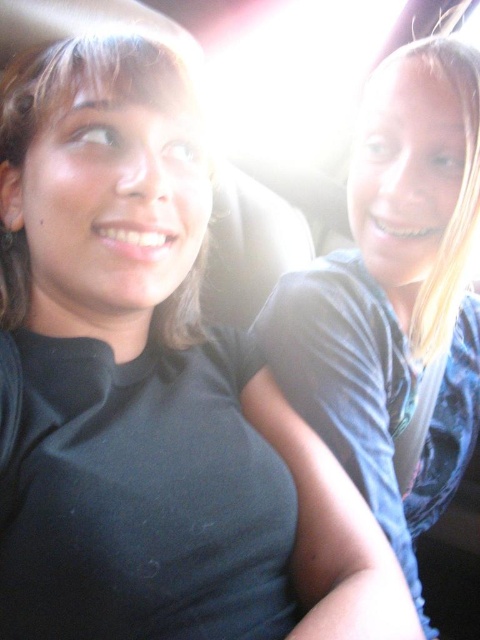
You are a photographer trying to capture a candid shot of the two people in the vehicle. You want to ensure the focus is on the point at point (312, 310). Given that your camera has a depth of field that can clearly capture objects within 30 inches from the focus point, will the two people be in focus?

The point (312, 310) is 31.08 inches away from the camera, which is slightly beyond the 30 inches depth of field range. Therefore, the two people may not be in focus as the distance exceeds the camera s depth of field limit.

You are a passenger in a car and want to adjust the seat to get a better view of the matte black hair at upper left and the blue fabric shirt at right. Based on their positions, which direction should you move the seat?

The matte black hair at upper left is behind the blue fabric shirt at right, so moving the seat forward would allow you to see both the matte black hair at upper left and the blue fabric shirt at right more clearly.